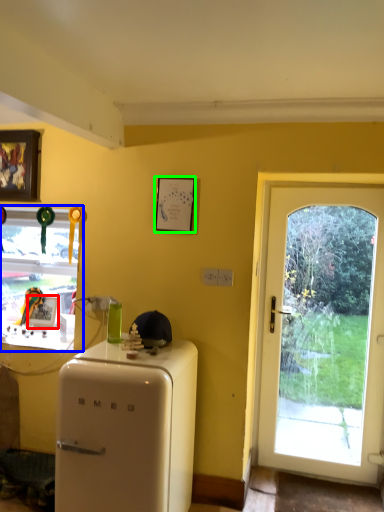
Question: Which object is positioned farthest from picture frame (highlighted by a red box)? Select from window (highlighted by a blue box) and picture frame (highlighted by a green box).

Choices:
 (A) window
 (B) picture frame

Answer: (B)